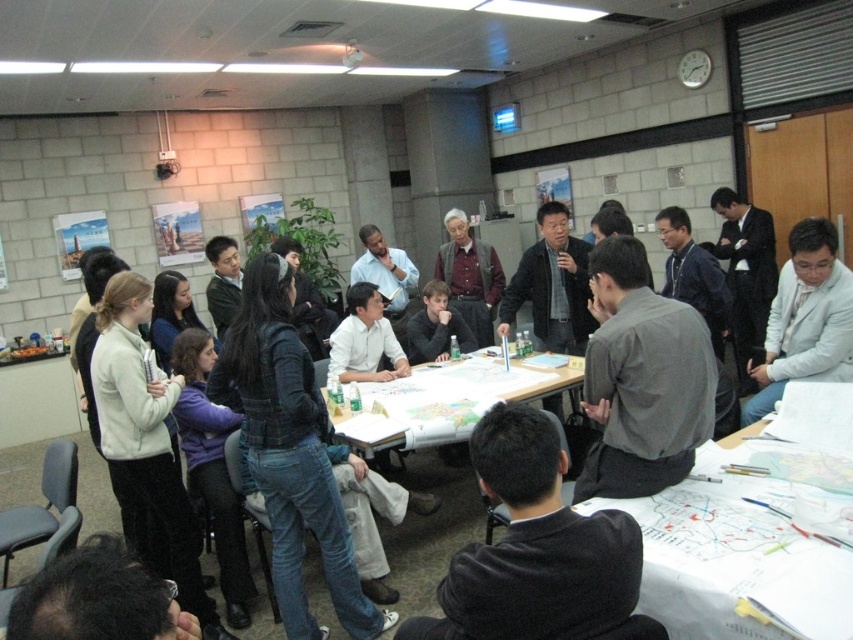
Question: Does gray fabric jacket at right appear under matte black shirt at center?

Choices:
 (A) no
 (B) yes

Answer: (B)

Question: Can you confirm if white fleece jacket at upper left is positioned to the right of gray fabric jacket at right?

Choices:
 (A) no
 (B) yes

Answer: (A)

Question: Which point appears closest to the camera in this image?

Choices:
 (A) (758, 273)
 (B) (317, 419)

Answer: (B)

Question: Is the position of black suit at right more distant than that of matte black shirt at center?

Choices:
 (A) yes
 (B) no

Answer: (A)

Question: Among these points, which one is farthest from the camera?

Choices:
 (A) (138, 634)
 (B) (724, 605)
 (C) (422, 316)
 (D) (693, 321)

Answer: (C)

Question: Which object is the farthest from the white paper at center?

Choices:
 (A) dark brown hair at lower center
 (B) white fleece jacket at upper left
 (C) gray matte shirt at center
 (D) denim jacket at center

Answer: (B)